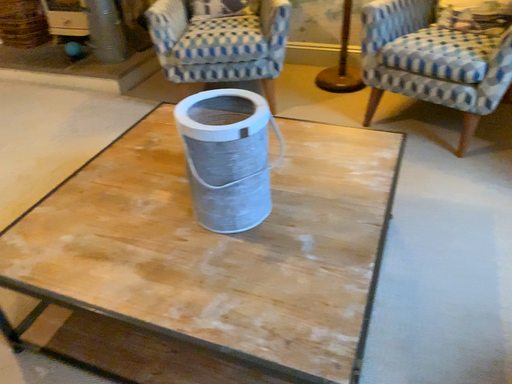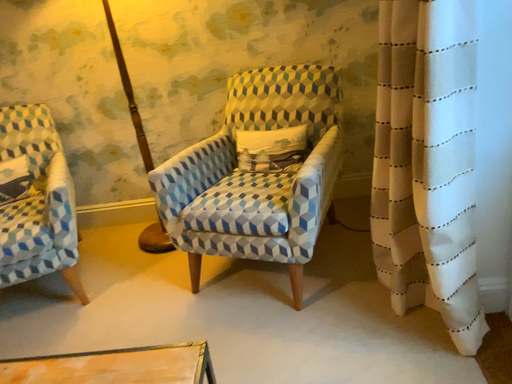
Question: How did the camera likely rotate when shooting the video?

Choices:
 (A) rotated downward
 (B) rotated upward

Answer: (B)